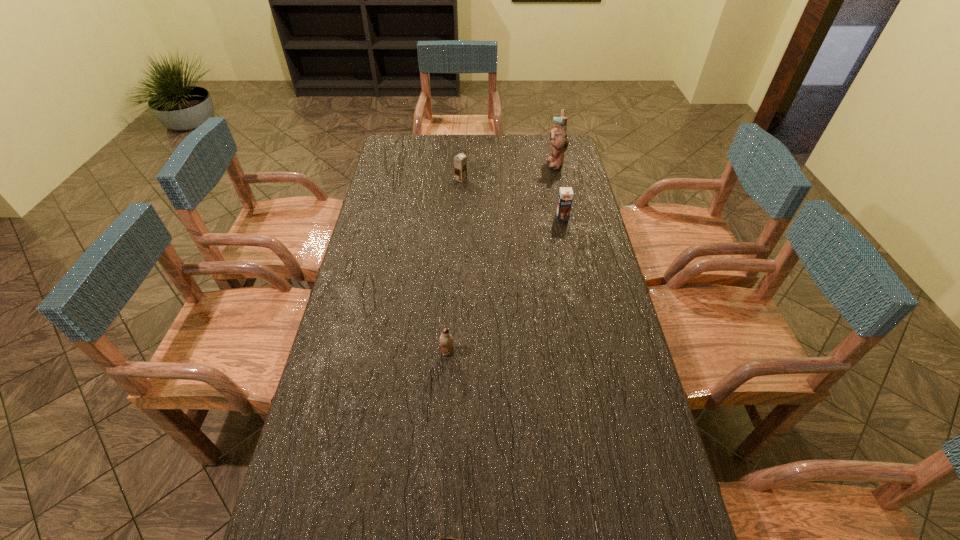
Image resolution: width=960 pixels, height=540 pixels. I want to click on the tallest object, so click(x=558, y=136).

Identify the location of figurine. (558, 136).

The image size is (960, 540). Identify the location of the rightmost chocolate milk. (565, 197).

This screenshot has width=960, height=540. What are the coordinates of `the third farthest object` in the screenshot? It's located at (565, 197).

At what (x,y) coordinates should I click in order to perform the action: click on the farthest chocolate milk. Please return your answer as a coordinate pair (x, y). This screenshot has width=960, height=540. Looking at the image, I should click on (460, 162).

Locate an element on the screen. The width and height of the screenshot is (960, 540). the nearest chocolate milk is located at coordinates (446, 339).

This screenshot has height=540, width=960. What are the coordinates of `free spot located on the front-facing side of the farthest object` in the screenshot? It's located at (536, 164).

This screenshot has width=960, height=540. Find the location of `vacant space located on the front-facing side of the farthest object`. vacant space located on the front-facing side of the farthest object is located at coordinates coord(529,164).

Where is `free space located 0.360m on the front-facing side of the farthest object`? free space located 0.360m on the front-facing side of the farthest object is located at coordinates (466, 164).

I want to click on vacant space located 0.120m on the front label of the third farthest object, so click(x=567, y=241).